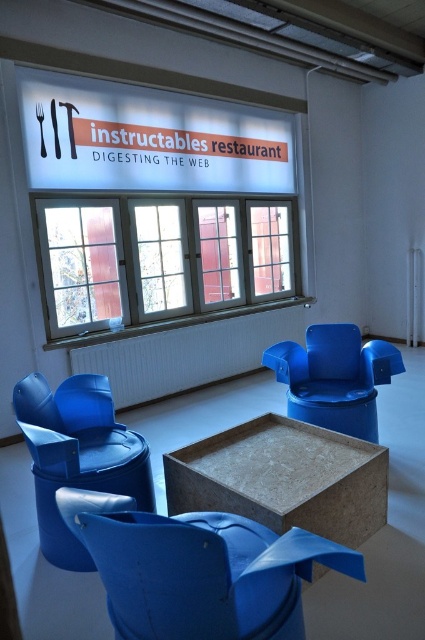
Question: Is clear glass window at center below matte blue armchair at center?

Choices:
 (A) yes
 (B) no

Answer: (B)

Question: Which point appears closest to the camera in this image?

Choices:
 (A) (84, 307)
 (B) (45, 486)
 (C) (274, 602)
 (D) (198, 488)

Answer: (C)

Question: Which point appears farthest from the camera in this image?

Choices:
 (A) (346, 422)
 (B) (292, 584)
 (C) (99, 376)
 (D) (190, 488)

Answer: (A)

Question: Which object is closer to the camera taking this photo?

Choices:
 (A) matte plastic armchair at center
 (B) brown cardboard table at center
 (C) matte blue armchair at center
 (D) matte blue armchair at lower left

Answer: (C)

Question: Does brown cardboard table at center have a larger size compared to matte blue armchair at lower left?

Choices:
 (A) no
 (B) yes

Answer: (B)

Question: Does matte blue armchair at center appear under brown cardboard table at center?

Choices:
 (A) yes
 (B) no

Answer: (B)